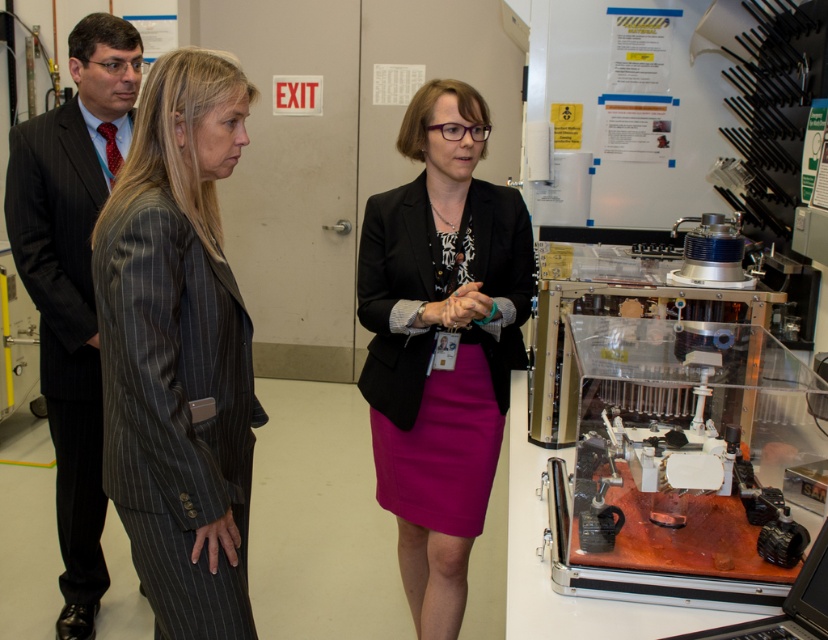
Question: Is matte black blazer at center positioned in front of fuchsia fabric skirt at center?

Choices:
 (A) yes
 (B) no

Answer: (A)

Question: Estimate the real-world distances between objects in this image. Which object is farther from the gray pinstripe suit at left?

Choices:
 (A) fuchsia fabric skirt at center
 (B) matte black blazer at center
 (C) black plastic laptop at lower right

Answer: (C)

Question: Which of the following is the farthest from the observer?

Choices:
 (A) matte black blazer at center
 (B) black plastic laptop at lower right

Answer: (A)

Question: Is matte black blazer at center wider than black pinstripe suit at left?

Choices:
 (A) no
 (B) yes

Answer: (B)

Question: Can you confirm if gray pinstripe suit at left is wider than black plastic laptop at lower right?

Choices:
 (A) no
 (B) yes

Answer: (B)

Question: Which object appears closest to the camera in this image?

Choices:
 (A) black plastic laptop at lower right
 (B) matte black blazer at center
 (C) fuchsia fabric skirt at center

Answer: (A)